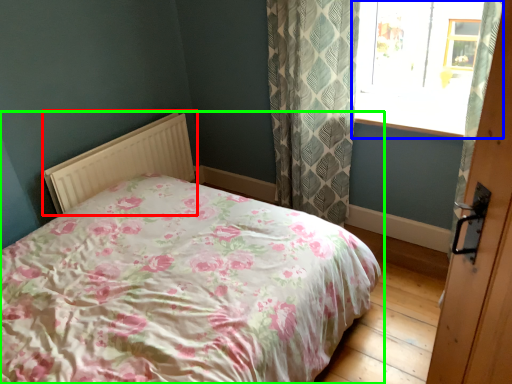
Question: Which is farther away from radiator (highlighted by a red box)? window (highlighted by a blue box) or bed (highlighted by a green box)?

Choices:
 (A) window
 (B) bed

Answer: (A)